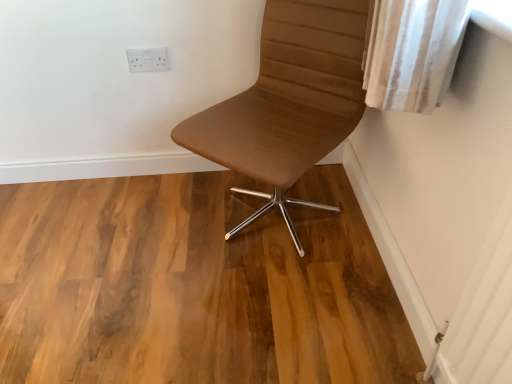
Question: Considering the positions of white plastic outlet at upper center and natural wood floor at center in the image, is white plastic outlet at upper center bigger or smaller than natural wood floor at center?

Choices:
 (A) big
 (B) small

Answer: (B)

Question: Would you say white plastic outlet at upper center is to the left or to the right of natural wood floor at center in the picture?

Choices:
 (A) left
 (B) right

Answer: (A)

Question: Which is nearer to the white plastic outlet at upper center?

Choices:
 (A) brown leather chair at center
 (B) natural wood floor at center

Answer: (A)

Question: Which object is positioned farthest from the natural wood floor at center?

Choices:
 (A) brown leather chair at center
 (B) white plastic outlet at upper center

Answer: (B)